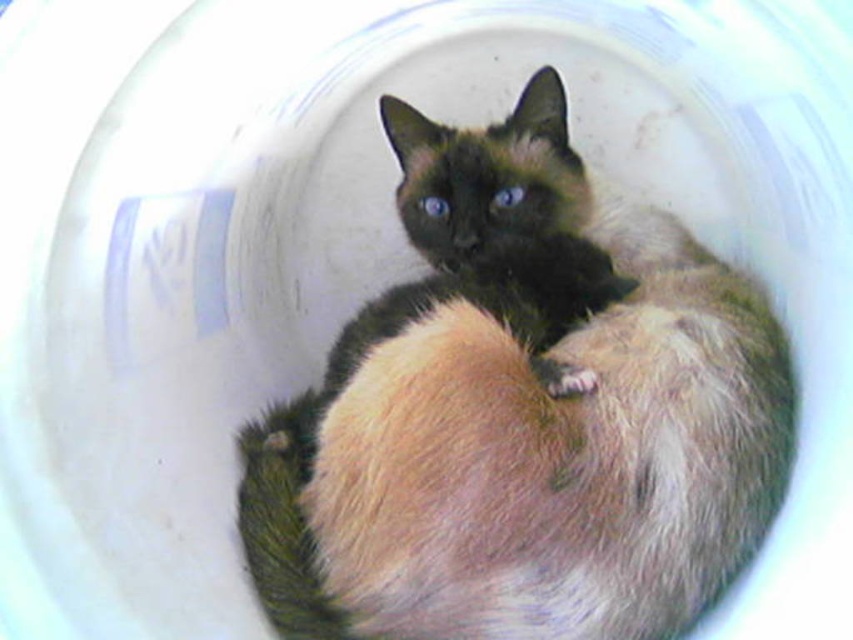
Does point (367, 529) lie behind point (592, 385)?

No, it is in front of (592, 385).

Can you confirm if silky fur cat at center is shorter than fuzzy fur paw at center?

Incorrect, silky fur cat at center's height does not fall short of fuzzy fur paw at center's.

This screenshot has width=853, height=640. Find the location of `silky fur cat at center`. silky fur cat at center is located at coordinates (521, 413).

Image resolution: width=853 pixels, height=640 pixels. What are the coordinates of `silky fur cat at center` in the screenshot? It's located at (521, 413).